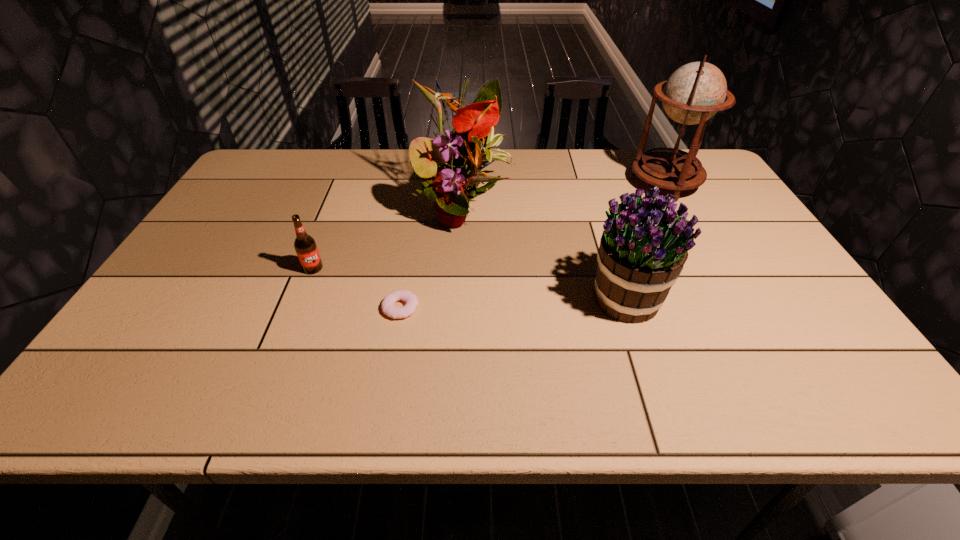
This screenshot has width=960, height=540. I want to click on globe, so click(695, 92).

Locate an element on the screen. the farther bouquet is located at coordinates (461, 156).

Identify the location of the left bouquet. The image size is (960, 540). (461, 156).

Find the location of `the fourth object from left to right`. the fourth object from left to right is located at coordinates (643, 248).

Where is `the nearer bouquet`? The width and height of the screenshot is (960, 540). the nearer bouquet is located at coordinates pos(643,248).

Where is `the leftmost object`? the leftmost object is located at coordinates (305, 246).

Image resolution: width=960 pixels, height=540 pixels. I want to click on the second shortest object, so click(x=305, y=246).

Where is `doughnut`? This screenshot has width=960, height=540. doughnut is located at coordinates (387, 305).

At what (x,y) coordinates should I click in order to perform the action: click on blank area located 0.140m on the surface of the globe. Please return your answer as a coordinate pair (x, y). Looking at the image, I should click on (587, 183).

What are the coordinates of `free region located on the surface of the globe` in the screenshot? It's located at (506, 183).